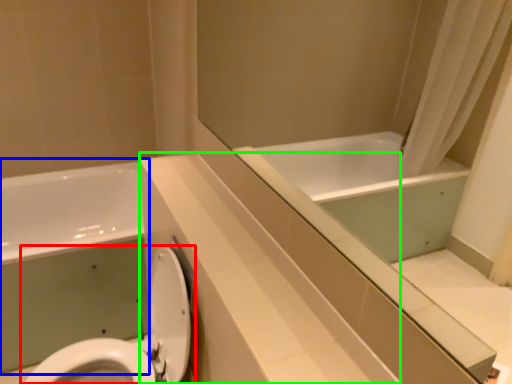
Question: Which object is positioned farthest from toilet (highlighted by a red box)? Select from bath (highlighted by a blue box) and counter top (highlighted by a green box).

Choices:
 (A) bath
 (B) counter top

Answer: (A)